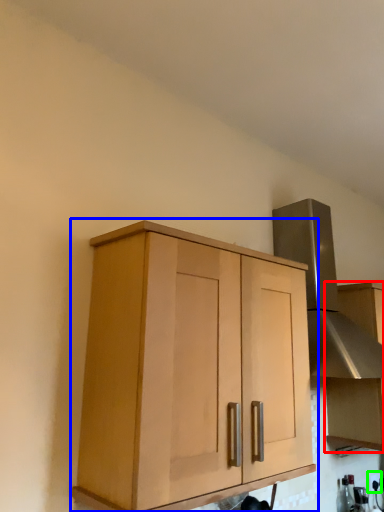
Question: Which is farther away from cabinetry (highlighted by a red box)? cabinetry (highlighted by a blue box) or electric outlet (highlighted by a green box)?

Choices:
 (A) cabinetry
 (B) electric outlet

Answer: (A)